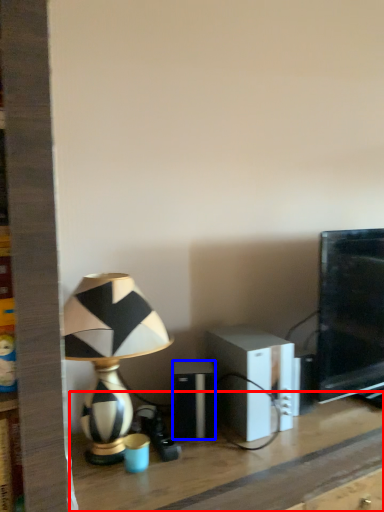
Question: Which of the following is the closest to the observer, table (highlighted by a red box) or speaker (highlighted by a blue box)?

Choices:
 (A) table
 (B) speaker

Answer: (A)